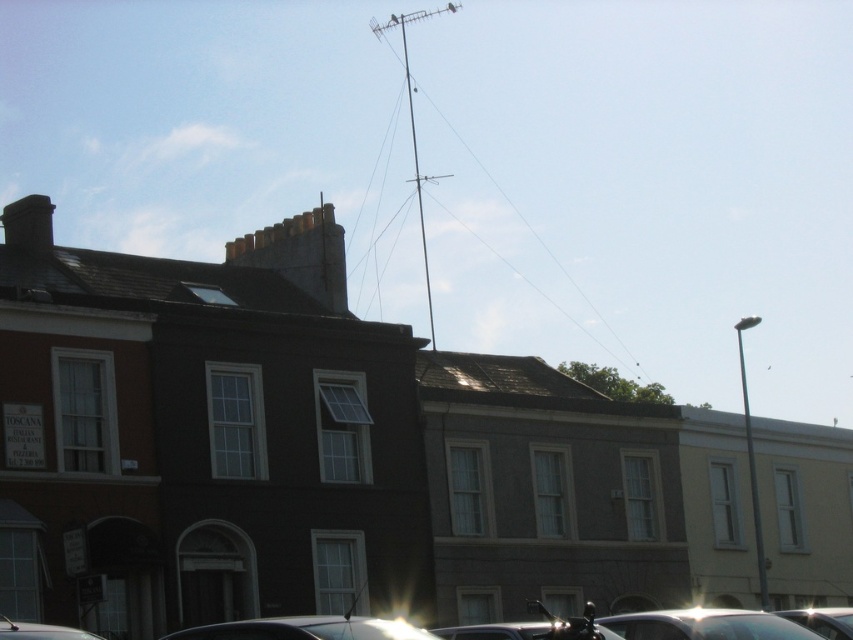
Is point (444, 177) in front of point (573, 627)?

No.

Between point (415, 12) and point (576, 625), which one is positioned in front?

Point (576, 625)

Identify the location of metallic antenna at upper center. (415, 128).

Does metallic silver car at lower center appear on the left side of metallic silver car at lower right?

Indeed, metallic silver car at lower center is positioned on the left side of metallic silver car at lower right.

Does metallic silver car at lower center appear under metallic silver car at lower right?

Incorrect, metallic silver car at lower center is not positioned below metallic silver car at lower right.

Describe the element at coordinates (306, 628) in the screenshot. I see `metallic silver car at lower center` at that location.

Where is `metallic silver car at lower center`? Image resolution: width=853 pixels, height=640 pixels. metallic silver car at lower center is located at coordinates (306, 628).

Is point (570, 621) farther from viewer compared to point (97, 636)?

No, it is not.

Between shiny chrome motorcycle at lower center and metallic silver car at lower left, which one appears on the right side from the viewer's perspective?

shiny chrome motorcycle at lower center is more to the right.

At what (x,y) coordinates should I click in order to perform the action: click on shiny chrome motorcycle at lower center. Please return your answer as a coordinate pair (x, y). This screenshot has height=640, width=853. Looking at the image, I should click on (567, 624).